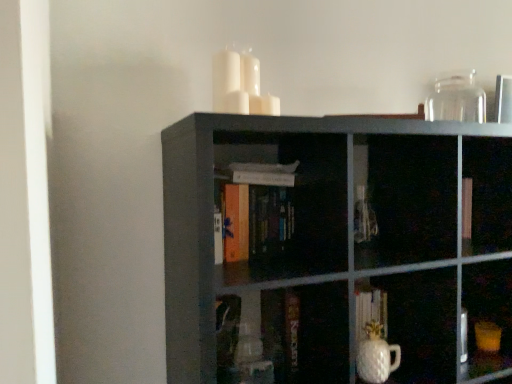
Question: Considering their positions, is transparent glass jar at upper right, the second glass vase positioned from the left, located in front of or behind white glossy vase at lower center, the second glass vase from the back?

Choices:
 (A) behind
 (B) front

Answer: (A)

Question: Considering the positions of transparent glass jar at upper right, the second glass vase positioned from the left, and white glossy vase at lower center, the second glass vase from the right, in the image, is transparent glass jar at upper right, the second glass vase positioned from the left, bigger or smaller than white glossy vase at lower center, the second glass vase from the right,?

Choices:
 (A) small
 (B) big

Answer: (B)

Question: Considering the real-world distances, which object is farthest from the white glossy vase at lower center, which is the first glass vase in front-to-back order?

Choices:
 (A) orange matte book at center
 (B) matte black bookshelf at center
 (C) transparent glass jar at upper right, the 2th glass vase when ordered from front to back

Answer: (C)

Question: Which is farther from the matte black bookshelf at center?

Choices:
 (A) transparent glass jar at upper right, the second glass vase positioned from the bottom
 (B) white glossy vase at lower center, the first glass vase in the bottom-to-top sequence
 (C) orange matte book at center

Answer: (A)